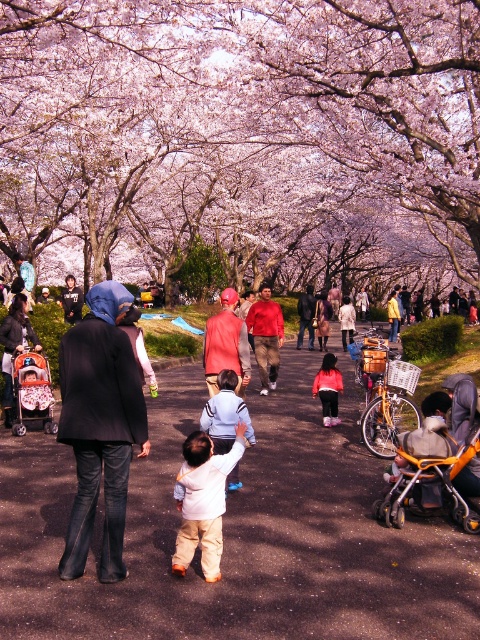
Based on the photo, can you confirm if denim jacket at left is positioned to the left of orange fleece jacket at center?

Indeed, denim jacket at left is positioned on the left side of orange fleece jacket at center.

Does denim jacket at left have a lesser height compared to orange fleece jacket at center?

Incorrect, denim jacket at left's height does not fall short of orange fleece jacket at center's.

Which is in front, point (120, 541) or point (319, 371)?

Point (120, 541) is in front.

I want to click on denim jacket at left, so click(99, 426).

Does smooth asphalt path at center have a lesser height compared to denim jacket at left?

Yes.

What do you see at coordinates (238, 534) in the screenshot? I see `smooth asphalt path at center` at bounding box center [238, 534].

Locate an element on the screen. Image resolution: width=480 pixels, height=640 pixels. smooth asphalt path at center is located at coordinates (238, 534).

Identify the location of smooth asphalt path at center. (238, 534).

Who is positioned more to the right, pink blossom tree at center or light beige pants at center?

light beige pants at center is more to the right.

Which is above, pink blossom tree at center or light beige pants at center?

pink blossom tree at center is above.

Describe the element at coordinates (242, 138) in the screenshot. I see `pink blossom tree at center` at that location.

This screenshot has width=480, height=640. I want to click on pink blossom tree at center, so click(x=242, y=138).